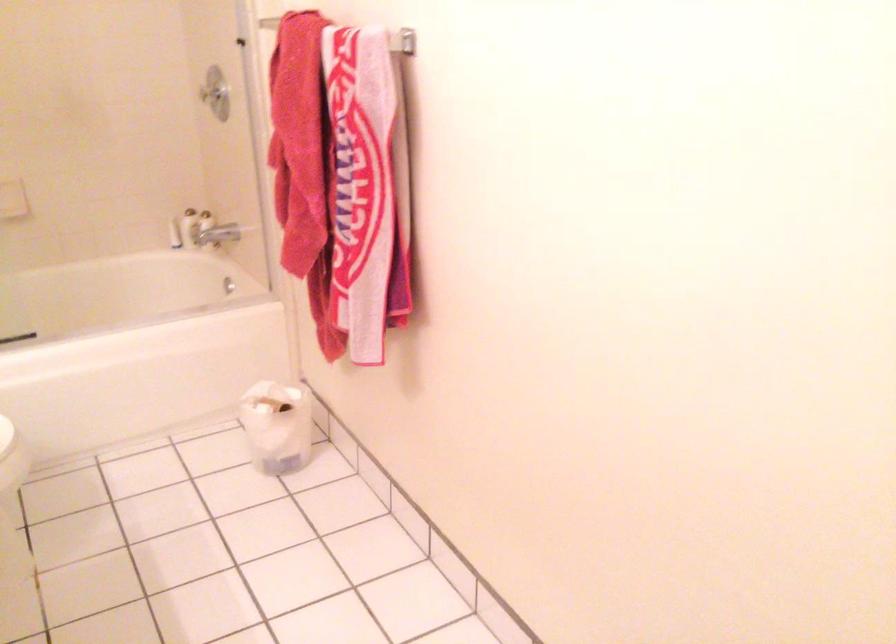
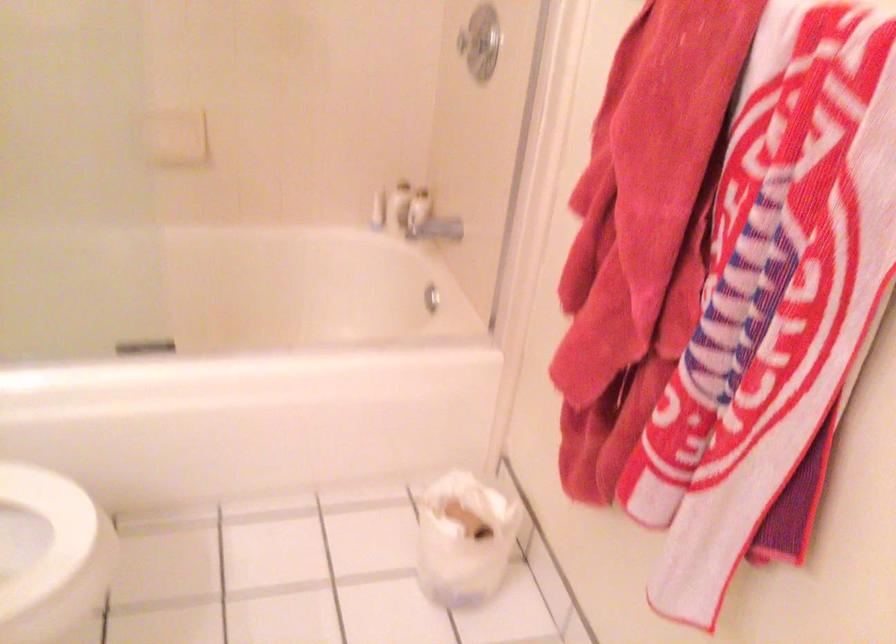
Where in the second image is the point corresponding to point 229,286 from the first image?

(431, 298)